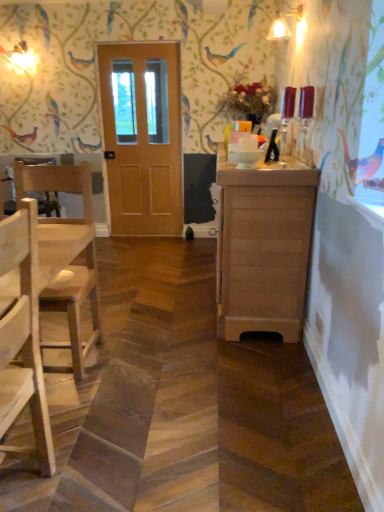
Image resolution: width=384 pixels, height=512 pixels. What do you see at coordinates (263, 247) in the screenshot?
I see `wooden cabinet at right` at bounding box center [263, 247].

What do you see at coordinates (142, 137) in the screenshot? The height and width of the screenshot is (512, 384). I see `wooden door at center` at bounding box center [142, 137].

In order to face natural wood chair at left, arranged as the first chair when viewed from the front, should I rotate leftwards or rightwards?

To align with it, rotate left about 25.166°.

The image size is (384, 512). In order to click on wooden cabinet at right in this screenshot , I will do `click(263, 247)`.

In the scene shown: Is wooden cabinet at right looking in the opposite direction of natural wood chair at left, the 2th chair in the front-to-back sequence?

No, wooden cabinet at right is not facing the opposite direction of natural wood chair at left, the 2th chair in the front-to-back sequence.

Can you confirm if wooden cabinet at right is positioned to the left of natural wood chair at left, the 1th chair when ordered from back to front?

No.

Measure the distance between wooden cabinet at right and natural wood chair at left, the 1th chair when ordered from back to front.

The distance of wooden cabinet at right from natural wood chair at left, the 1th chair when ordered from back to front, is 37.54 inches.

From the image's perspective, would you say wooden cabinet at right is shown under natural wood chair at left, the 2th chair in the front-to-back sequence?

No.

Is natural wood chair at left, the 1th chair when ordered from back to front, taller than natural wood chair at left, placed as the 2th chair when sorted from back to front?

Yes.

From a real-world perspective, between natural wood chair at left, the 2th chair in the front-to-back sequence, and natural wood chair at left, arranged as the first chair when viewed from the front, who is vertically lower?

From a 3D spatial view, natural wood chair at left, arranged as the first chair when viewed from the front, is below.

Are natural wood chair at left, the 1th chair when ordered from back to front, and natural wood chair at left, arranged as the first chair when viewed from the front, far apart?

No, natural wood chair at left, the 1th chair when ordered from back to front, is in close proximity to natural wood chair at left, arranged as the first chair when viewed from the front.

From a real-world perspective, relative to wooden door at center, is natural wood chair at left, the 1th chair when ordered from back to front, vertically above or below?

natural wood chair at left, the 1th chair when ordered from back to front, is below wooden door at center.

Which of these two, natural wood chair at left, the 1th chair when ordered from back to front, or wooden door at center, stands taller?

Standing taller between the two is wooden door at center.

Is natural wood chair at left, the 2th chair in the front-to-back sequence, beside wooden door at center?

No, natural wood chair at left, the 2th chair in the front-to-back sequence, is not making contact with wooden door at center.

Considering the sizes of objects natural wood chair at left, the 2th chair in the front-to-back sequence, and wooden door at center in the image provided, who is bigger, natural wood chair at left, the 2th chair in the front-to-back sequence, or wooden door at center?

natural wood chair at left, the 2th chair in the front-to-back sequence, is bigger.

Where is `the 1st chair to the left of the wooden cabinet at right, starting your count from the anchor`? the 1st chair to the left of the wooden cabinet at right, starting your count from the anchor is located at coordinates (23, 336).

Which object is further away from the camera, natural wood chair at left, placed as the 2th chair when sorted from back to front, or wooden cabinet at right?

wooden cabinet at right is further from the camera.

Is point (33, 356) closer or farther from the camera than point (263, 318)?

Clearly, point (33, 356) is closer to the camera than point (263, 318).

Does natural wood chair at left, placed as the 2th chair when sorted from back to front, touch wooden cabinet at right?

No, natural wood chair at left, placed as the 2th chair when sorted from back to front, is not next to wooden cabinet at right.

Which object is positioned more to the left, wooden door at center or natural wood chair at left, the 1th chair when ordered from back to front?

Positioned to the left is natural wood chair at left, the 1th chair when ordered from back to front.

Could you measure the distance between wooden door at center and natural wood chair at left, the 1th chair when ordered from back to front?

wooden door at center and natural wood chair at left, the 1th chair when ordered from back to front, are 2.09 meters apart.

Is wooden door at center aimed at natural wood chair at left, the 1th chair when ordered from back to front?

Yes, wooden door at center faces towards natural wood chair at left, the 1th chair when ordered from back to front.

You are a GUI agent. You are given a task and a screenshot of the screen. Output one action in this format:
    pyautogui.click(x=<x>, y=<y>)
    Task: Click on the door behind the natural wood chair at left, the 1th chair when ordered from back to front
    The height and width of the screenshot is (512, 384).
    Given the screenshot: What is the action you would take?
    pyautogui.click(x=142, y=137)

Does wooden door at center lie behind wooden cabinet at right?

Yes.

Can you confirm if wooden door at center is taller than wooden cabinet at right?

Yes.

From the image's perspective, is wooden door at center on top of wooden cabinet at right?

Yes, from the image's perspective, wooden door at center is above wooden cabinet at right.

From the image's perspective, between natural wood chair at left, arranged as the first chair when viewed from the front, and wooden door at center, who is located below?

From the image's view, natural wood chair at left, arranged as the first chair when viewed from the front, is below.

Which point is more distant from viewer, [35,440] or [131,170]?

The point [131,170] is behind.

This screenshot has width=384, height=512. Find the location of `door located above the natural wood chair at left, arranged as the first chair when viewed from the front (from the image's perspective)`. door located above the natural wood chair at left, arranged as the first chair when viewed from the front (from the image's perspective) is located at coordinates (142, 137).

Does natural wood chair at left, arranged as the first chair when viewed from the front, have a lesser width compared to wooden door at center?

No.

Where is `cabinetry located underneath the natural wood chair at left, the 2th chair in the front-to-back sequence (from a real-world perspective)`? The width and height of the screenshot is (384, 512). cabinetry located underneath the natural wood chair at left, the 2th chair in the front-to-back sequence (from a real-world perspective) is located at coordinates (263, 247).

Where is `chair on the left of the natural wood chair at left, placed as the 2th chair when sorted from back to front`? The width and height of the screenshot is (384, 512). chair on the left of the natural wood chair at left, placed as the 2th chair when sorted from back to front is located at coordinates click(67, 252).

Considering their positions, is wooden door at center positioned closer to wooden cabinet at right than natural wood chair at left, the 1th chair when ordered from back to front?

The object closer to wooden cabinet at right is natural wood chair at left, the 1th chair when ordered from back to front.

Which object lies further to the anchor point natural wood chair at left, the 1th chair when ordered from back to front, natural wood chair at left, arranged as the first chair when viewed from the front, or wooden door at center?

wooden door at center is further to natural wood chair at left, the 1th chair when ordered from back to front.

Looking at the image, which one is located closer to wooden door at center, natural wood chair at left, placed as the 2th chair when sorted from back to front, or natural wood chair at left, the 2th chair in the front-to-back sequence?

natural wood chair at left, the 2th chair in the front-to-back sequence, is positioned closer to the anchor wooden door at center.

In the scene shown: Considering their positions, is natural wood chair at left, the 2th chair in the front-to-back sequence, positioned closer to natural wood chair at left, placed as the 2th chair when sorted from back to front, than wooden door at center?

natural wood chair at left, the 2th chair in the front-to-back sequence, is closer to natural wood chair at left, placed as the 2th chair when sorted from back to front.

From the picture: From the image, which object appears to be farther from wooden door at center, natural wood chair at left, the 2th chair in the front-to-back sequence, or natural wood chair at left, arranged as the first chair when viewed from the front?

The object further to wooden door at center is natural wood chair at left, arranged as the first chair when viewed from the front.

Based on their spatial positions, is natural wood chair at left, placed as the 2th chair when sorted from back to front, or wooden cabinet at right closer to natural wood chair at left, the 2th chair in the front-to-back sequence?

natural wood chair at left, placed as the 2th chair when sorted from back to front, is closer to natural wood chair at left, the 2th chair in the front-to-back sequence.

When comparing their distances from wooden door at center, does wooden cabinet at right or natural wood chair at left, the 2th chair in the front-to-back sequence, seem further?

wooden cabinet at right.

When comparing their distances from natural wood chair at left, the 1th chair when ordered from back to front, does wooden door at center or wooden cabinet at right seem closer?

wooden cabinet at right is positioned closer to the anchor natural wood chair at left, the 1th chair when ordered from back to front.

At what (x,y) coordinates should I click in order to perform the action: click on cabinetry between natural wood chair at left, arranged as the first chair when viewed from the front, and wooden door at center, along the z-axis. Please return your answer as a coordinate pair (x, y). The width and height of the screenshot is (384, 512). Looking at the image, I should click on (263, 247).

Image resolution: width=384 pixels, height=512 pixels. Find the location of `cabinetry located between natural wood chair at left, the 1th chair when ordered from back to front, and wooden door at center in the depth direction`. cabinetry located between natural wood chair at left, the 1th chair when ordered from back to front, and wooden door at center in the depth direction is located at coordinates (263, 247).

Where is `chair between natural wood chair at left, the 1th chair when ordered from back to front, and wooden cabinet at right, in the horizontal direction`? This screenshot has height=512, width=384. chair between natural wood chair at left, the 1th chair when ordered from back to front, and wooden cabinet at right, in the horizontal direction is located at coordinates (23, 336).

You are a GUI agent. You are given a task and a screenshot of the screen. Output one action in this format:
    pyautogui.click(x=<x>, y=<y>)
    Task: Click on the chair between natural wood chair at left, placed as the 2th chair when sorted from back to front, and wooden door at center, along the z-axis
    
    Given the screenshot: What is the action you would take?
    pyautogui.click(x=67, y=252)